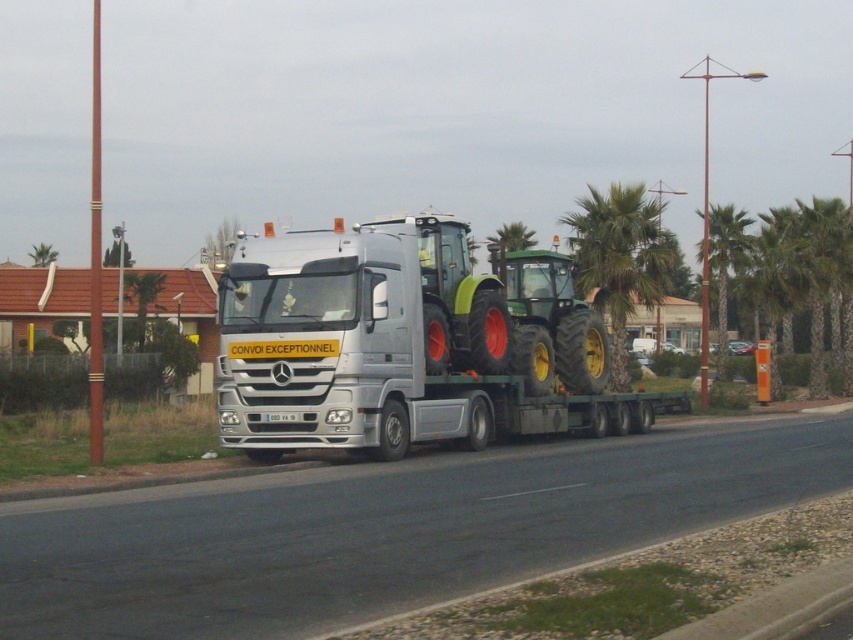
Does green leafy palm tree at center lie in front of green leafy palm tree at right?

Yes, it is in front of green leafy palm tree at right.

Which of these two, green leafy palm tree at center or green leafy palm tree at right, stands taller?

Standing taller between the two is green leafy palm tree at center.

Between point (625, 273) and point (711, 230), which one is positioned in front?

Point (625, 273)

At what (x,y) coordinates should I click in order to perform the action: click on green leafy palm tree at center. Please return your answer as a coordinate pair (x, y). The width and height of the screenshot is (853, 640). Looking at the image, I should click on (619, 259).

Is silver metallic truck at center positioned before green leafy palm tree at center?

That is True.

Is silver metallic truck at center positioned behind green leafy palm tree at center?

No, it is not.

Who is more distant from viewer, (645, 392) or (642, 230)?

The point (642, 230) is behind.

Where is `silver metallic truck at center`? The image size is (853, 640). silver metallic truck at center is located at coordinates (408, 342).

Is silver metallic truck at center closer to camera compared to green leafy palm tree at right?

Yes.

Which is in front, point (631, 429) or point (744, 244)?

Positioned in front is point (631, 429).

The width and height of the screenshot is (853, 640). In order to click on silver metallic truck at center in this screenshot , I will do `click(408, 342)`.